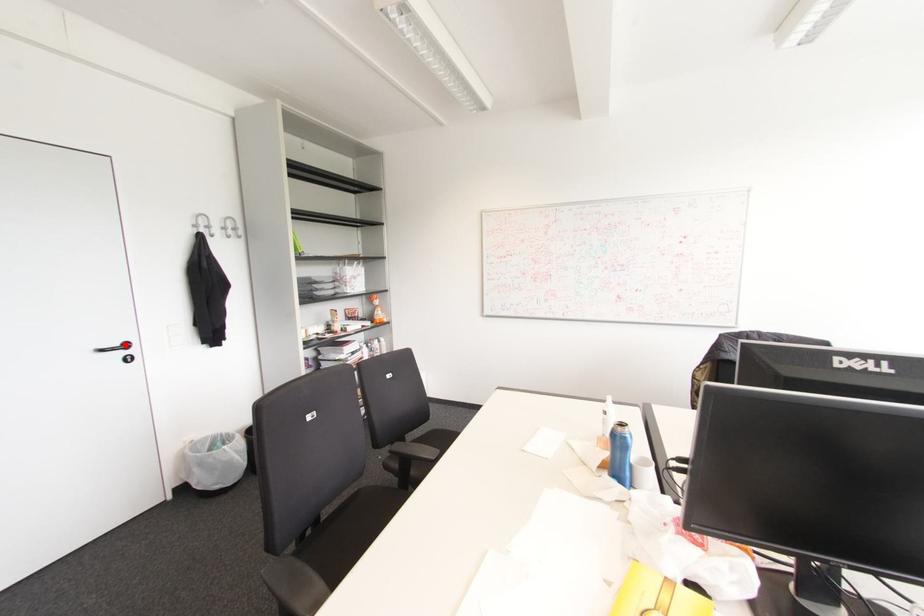
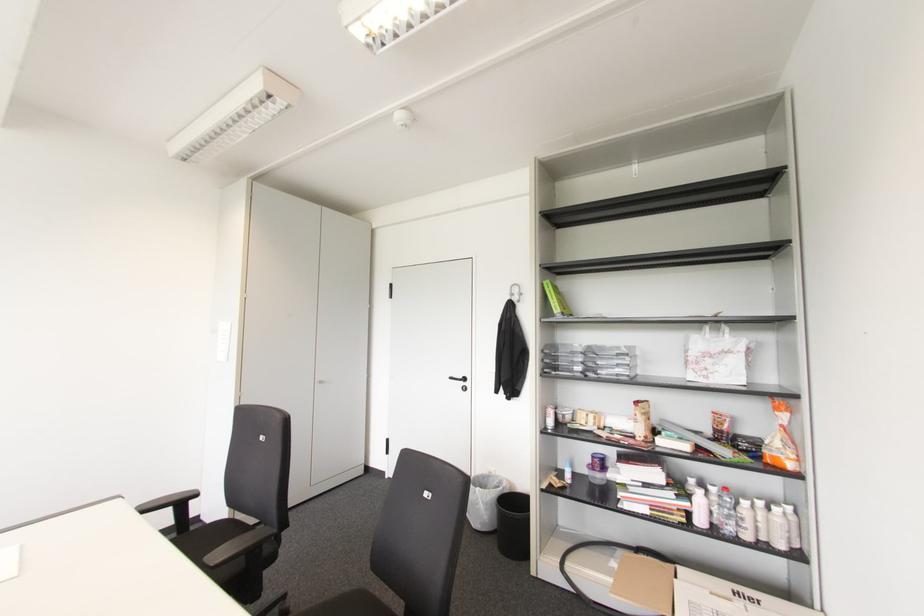
In the second image, find the point that corresponds to the highlighted location in the first image.

(464, 379)